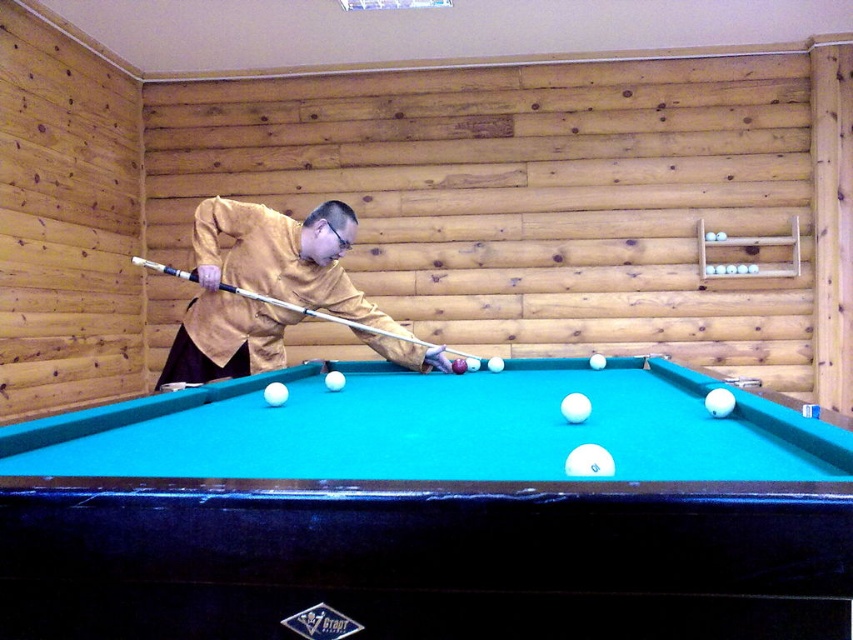
Is point (738, 609) positioned behind point (257, 292)?

No, (738, 609) is in front of (257, 292).

Who is lower down, teal felt billiard table at center or white plastic cue at center?

teal felt billiard table at center is lower down.

Where is `teal felt billiard table at center`? The image size is (853, 640). teal felt billiard table at center is located at coordinates (428, 509).

At what (x,y) coordinates should I click in order to perform the action: click on teal felt billiard table at center. Please return your answer as a coordinate pair (x, y). This screenshot has width=853, height=640. Looking at the image, I should click on (428, 509).

Can you confirm if matte yellow shirt at center is smaller than white plastic cue at center?

Actually, matte yellow shirt at center might be larger than white plastic cue at center.

Is matte yellow shirt at center thinner than white plastic cue at center?

Yes, matte yellow shirt at center is thinner than white plastic cue at center.

This screenshot has width=853, height=640. What do you see at coordinates (262, 285) in the screenshot?
I see `matte yellow shirt at center` at bounding box center [262, 285].

You are a GUI agent. You are given a task and a screenshot of the screen. Output one action in this format:
    pyautogui.click(x=<x>, y=<y>)
    Task: Click on the matte yellow shirt at center
    Image resolution: width=853 pixels, height=640 pixels.
    Given the screenshot: What is the action you would take?
    pyautogui.click(x=262, y=285)

Does point (753, 412) come behind point (289, 272)?

No.

Does teal felt billiard table at center have a larger size compared to matte yellow shirt at center?

Yes.

Is point (653, 481) farther from camera compared to point (251, 256)?

No, (653, 481) is in front of (251, 256).

Where is `teal felt billiard table at center`? This screenshot has height=640, width=853. teal felt billiard table at center is located at coordinates (428, 509).